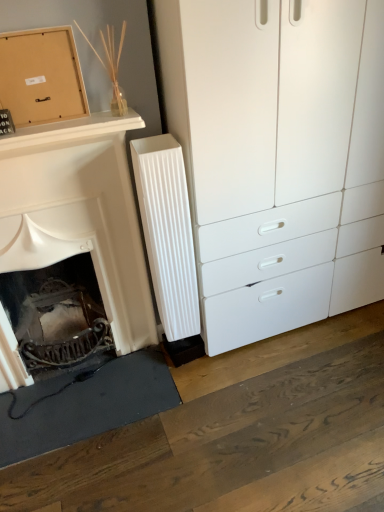
Question: Does white ribbed radiator at center have a greater width compared to matte cardboard box at upper left?

Choices:
 (A) no
 (B) yes

Answer: (B)

Question: Can you confirm if white ribbed radiator at center is positioned to the right of matte cardboard box at upper left?

Choices:
 (A) no
 (B) yes

Answer: (B)

Question: Is white ribbed radiator at center facing towards matte cardboard box at upper left?

Choices:
 (A) no
 (B) yes

Answer: (A)

Question: Can you confirm if white ribbed radiator at center is smaller than matte cardboard box at upper left?

Choices:
 (A) no
 (B) yes

Answer: (A)

Question: Is there a large distance between white ribbed radiator at center and matte cardboard box at upper left?

Choices:
 (A) no
 (B) yes

Answer: (A)

Question: Visually, is white matte fireplace at left positioned to the left or to the right of matte cardboard box at upper left?

Choices:
 (A) left
 (B) right

Answer: (A)

Question: Considering their positions, is white matte fireplace at left located in front of or behind matte cardboard box at upper left?

Choices:
 (A) behind
 (B) front

Answer: (B)

Question: Considering the positions of white matte fireplace at left and matte cardboard box at upper left in the image, is white matte fireplace at left bigger or smaller than matte cardboard box at upper left?

Choices:
 (A) big
 (B) small

Answer: (A)

Question: From a real-world perspective, is white matte fireplace at left physically located above or below matte cardboard box at upper left?

Choices:
 (A) below
 (B) above

Answer: (A)

Question: Is white ribbed radiator at center to the left or to the right of white plastic chest of drawers at right in the image?

Choices:
 (A) right
 (B) left

Answer: (B)

Question: Considering the positions of white ribbed radiator at center and white plastic chest of drawers at right in the image, is white ribbed radiator at center bigger or smaller than white plastic chest of drawers at right?

Choices:
 (A) big
 (B) small

Answer: (B)

Question: From the image's perspective, relative to white plastic chest of drawers at right, is white ribbed radiator at center above or below?

Choices:
 (A) above
 (B) below

Answer: (B)

Question: From their relative heights in the image, would you say white ribbed radiator at center is taller or shorter than white plastic chest of drawers at right?

Choices:
 (A) short
 (B) tall

Answer: (A)

Question: Relative to matte cardboard box at upper left, is white ribbed radiator at center in front or behind?

Choices:
 (A) behind
 (B) front

Answer: (A)

Question: Does point (165, 183) appear closer or farther from the camera than point (6, 99)?

Choices:
 (A) farther
 (B) closer

Answer: (A)